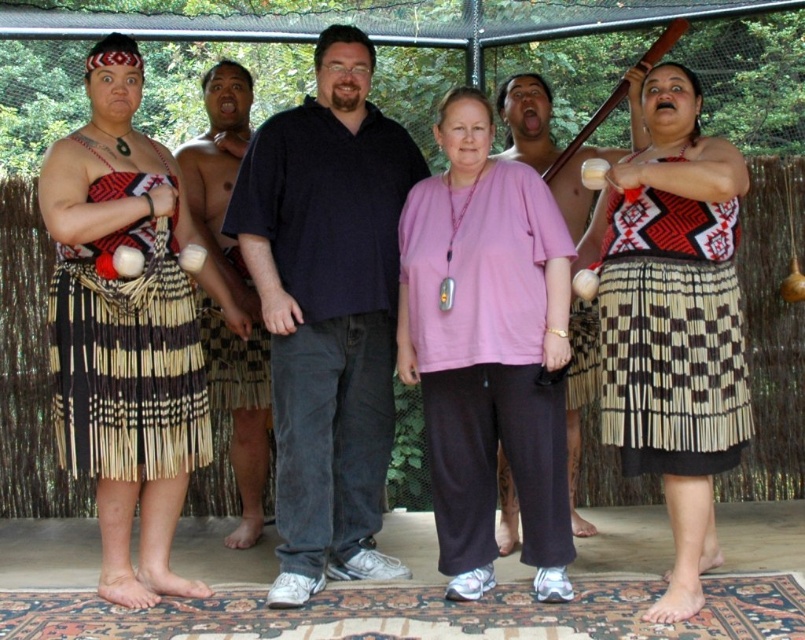
Question: Which object appears farthest from the camera in this image?

Choices:
 (A) pink fabric shirt at center
 (B) dark blue shirt at center

Answer: (A)

Question: Can you confirm if matte black skirt at center is smaller than matte black shirt at center?

Choices:
 (A) yes
 (B) no

Answer: (B)

Question: Is natural woven skirt at left positioned behind brown woven skirt at center?

Choices:
 (A) no
 (B) yes

Answer: (A)

Question: Which point is farther to the camera?

Choices:
 (A) matte black shirt at center
 (B) dark blue shirt at center

Answer: (A)

Question: Can you confirm if matte black skirt at center is positioned above matte black shirt at center?

Choices:
 (A) no
 (B) yes

Answer: (A)

Question: Which of the following is the closest to the observer?

Choices:
 (A) (387, 273)
 (B) (228, 196)
 (C) (497, 476)
 (D) (199, 408)

Answer: (D)